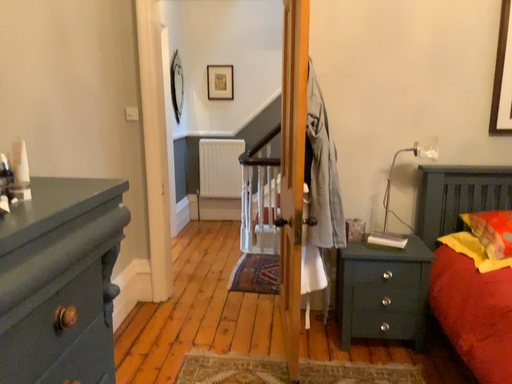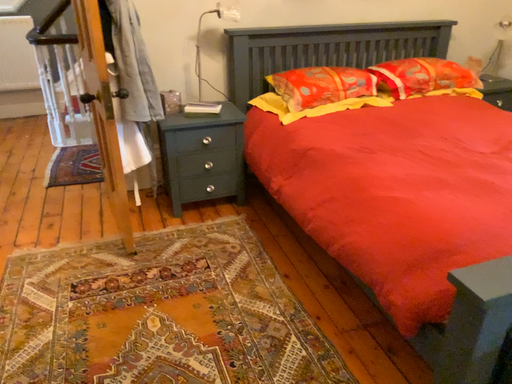
Question: Which way did the camera rotate in the video?

Choices:
 (A) rotated left
 (B) rotated right

Answer: (B)